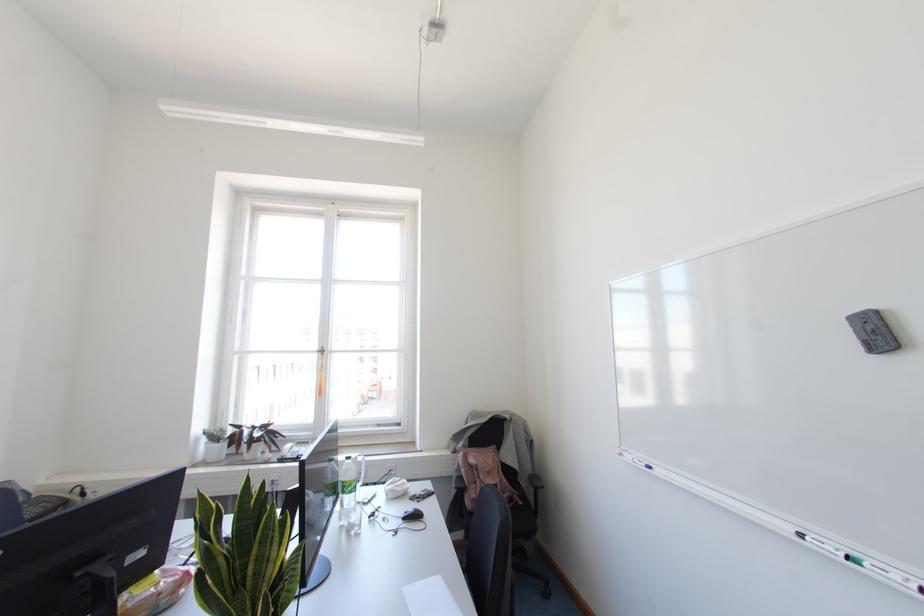
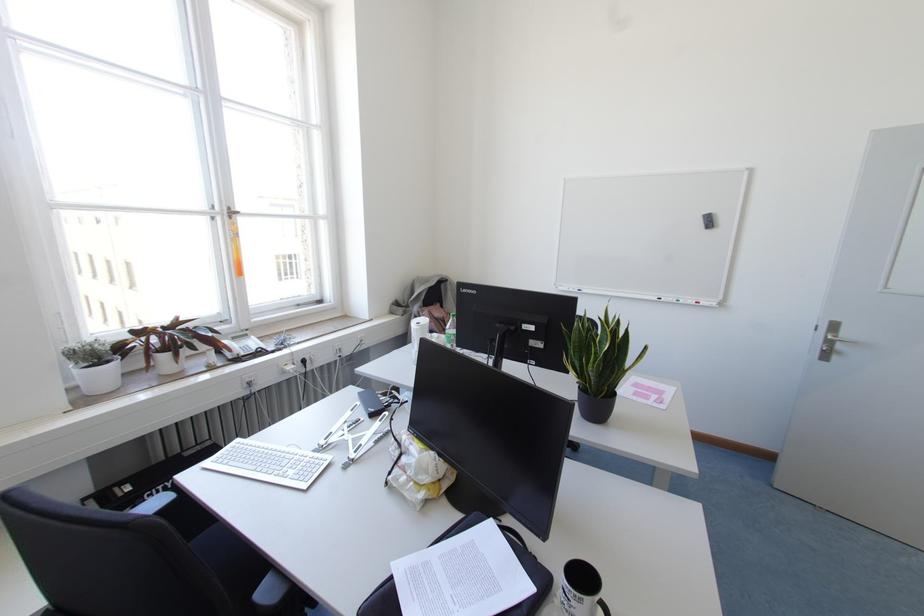
Locate, in the second image, the point that corresponds to point 800,536 in the first image.

(659, 299)